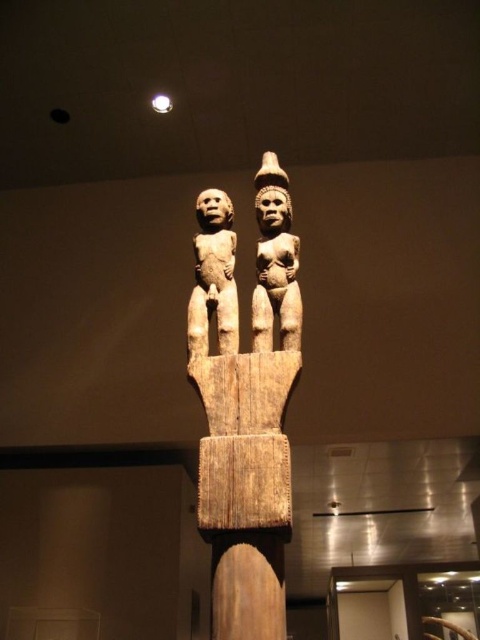
You are an art conservator examining the wooden sculpture. You notice that the brown wooden statue at center and the light brown wood figure at center have different thicknesses. Which one is thinner?

The brown wooden statue at center is thinner than the light brown wood figure at center.

You are an art curator examining the sculpture. You notice two figures in the center. Which one is closer to you, the wooden statue at center or the light brown wood figure at center?

The wooden statue at center is closer to you as it is in front of the light brown wood figure at center.